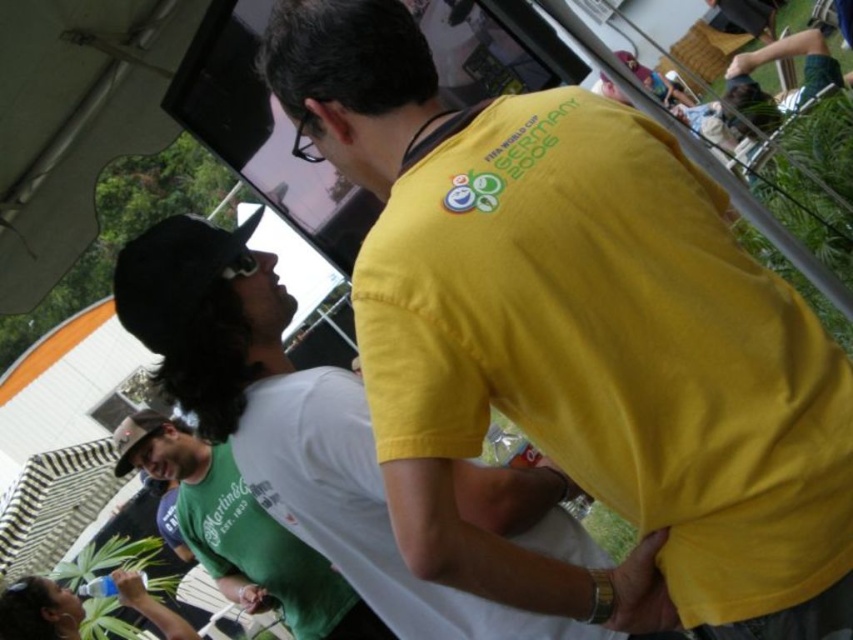
Question: Among these points, which one is farthest from the camera?

Choices:
 (A) (303, 556)
 (B) (769, 435)
 (C) (294, 476)

Answer: (A)

Question: Which object is farther from the camera taking this photo?

Choices:
 (A) yellow cotton shirt at center
 (B) green matte shirt at center

Answer: (B)

Question: Considering the relative positions of yellow cotton shirt at center and green matte shirt at center in the image provided, where is yellow cotton shirt at center located with respect to green matte shirt at center?

Choices:
 (A) right
 (B) left

Answer: (A)

Question: Among these points, which one is farthest from the camera?

Choices:
 (A) (213, 380)
 (B) (527, 570)
 (C) (222, 522)

Answer: (C)

Question: Is yellow cotton shirt at upper center positioned behind green matte shirt at center?

Choices:
 (A) no
 (B) yes

Answer: (A)

Question: Does yellow cotton shirt at upper center have a larger size compared to green matte shirt at center?

Choices:
 (A) yes
 (B) no

Answer: (B)